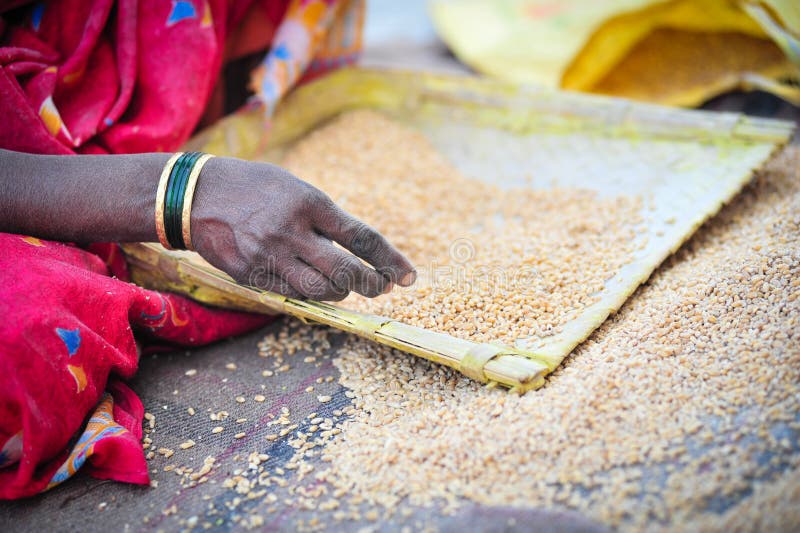
Identify the location of red stripe in plaid fabric. The width and height of the screenshot is (800, 533). (257, 419).